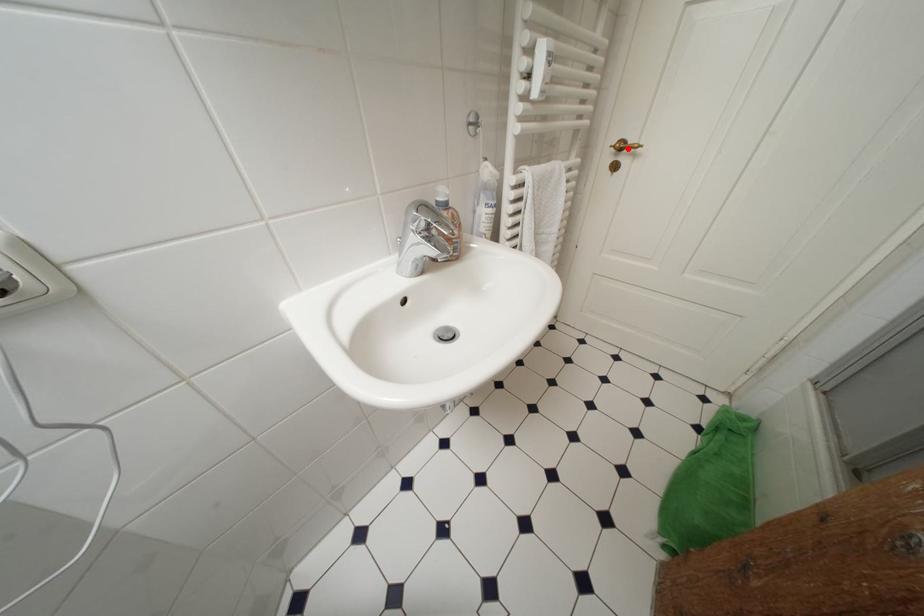
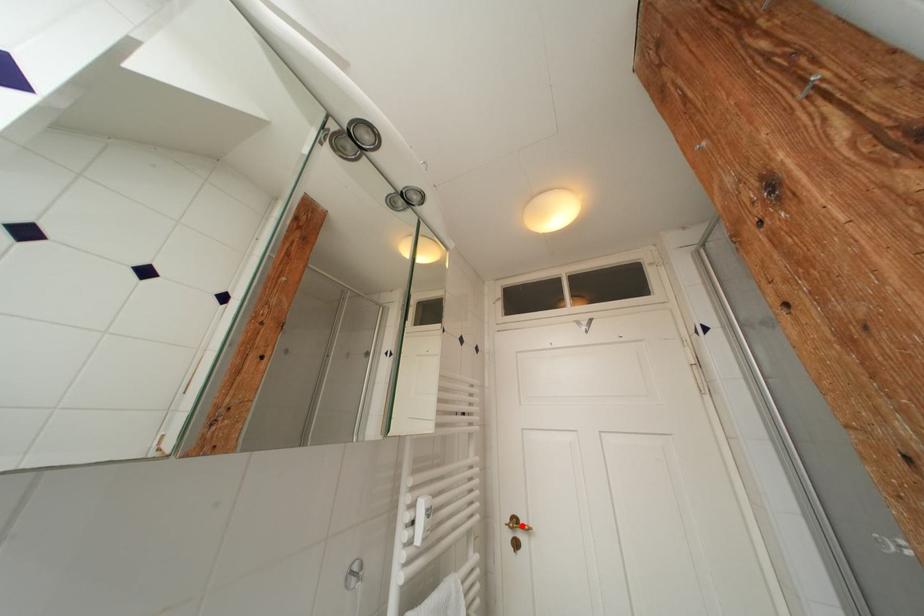
I am providing you with two images of the same scene from different viewpoints. A red point is marked on the first image and another point is marked on the second image. Is the red point in image1 aligned with the point shown in image2?

Yes